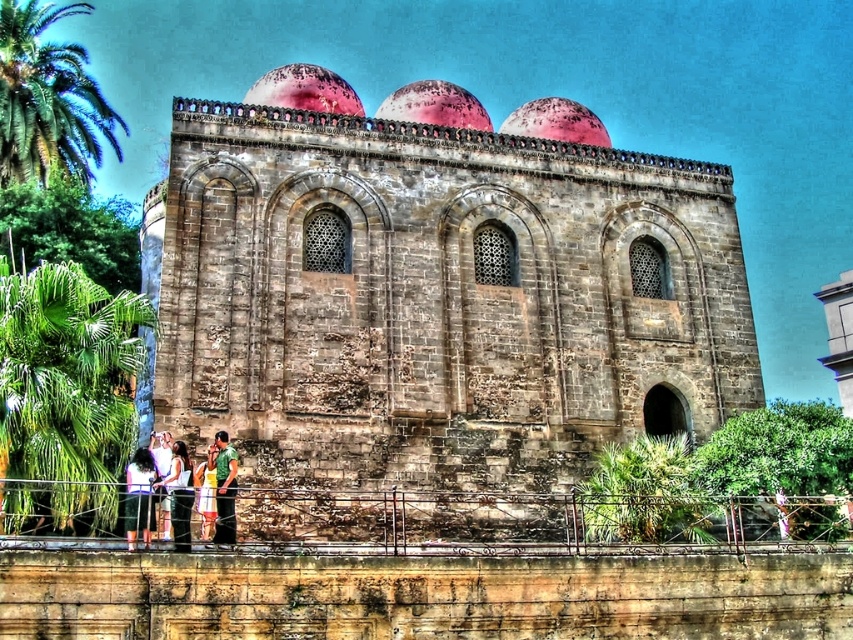
Question: Does dark green fabric dress at lower left lie behind white cotton shirt at lower center?

Choices:
 (A) no
 (B) yes

Answer: (A)

Question: Which of the following is the farthest from the observer?

Choices:
 (A) (199, 493)
 (B) (160, 445)
 (C) (186, 481)

Answer: (B)

Question: Considering the relative positions of green leafy palm tree at lower left and green fabric shirt at lower center in the image provided, where is green leafy palm tree at lower left located with respect to green fabric shirt at lower center?

Choices:
 (A) right
 (B) left

Answer: (B)

Question: Is green leafy palm tree at upper left to the left of dark green fabric dress at lower left from the viewer's perspective?

Choices:
 (A) no
 (B) yes

Answer: (B)

Question: Estimate the real-world distances between objects in this image. Which object is farther from the dark green fabric dress at lower left?

Choices:
 (A) green leafy palm tree at upper left
 (B) stone church at center
 (C) yellow cotton dress at lower center
 (D) white cotton dress at lower center

Answer: (A)

Question: Based on their relative distances, which object is farther from the green leafy palm tree at lower left?

Choices:
 (A) yellow cotton dress at lower center
 (B) white cotton shirt at lower center
 (C) white cotton dress at lower center
 (D) dark green fabric dress at lower left

Answer: (B)